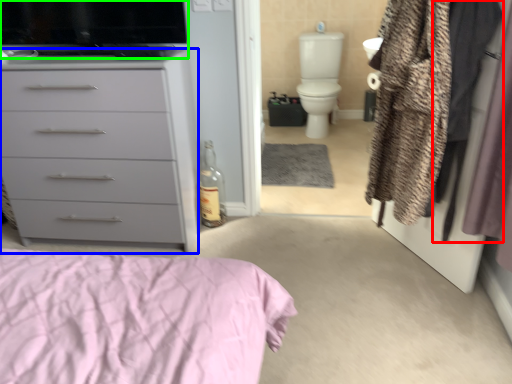
Question: Considering the real-world distances, which object is closest to clothing (highlighted by a red box)? chest of drawers (highlighted by a blue box) or appliance (highlighted by a green box).

Choices:
 (A) chest of drawers
 (B) appliance

Answer: (B)